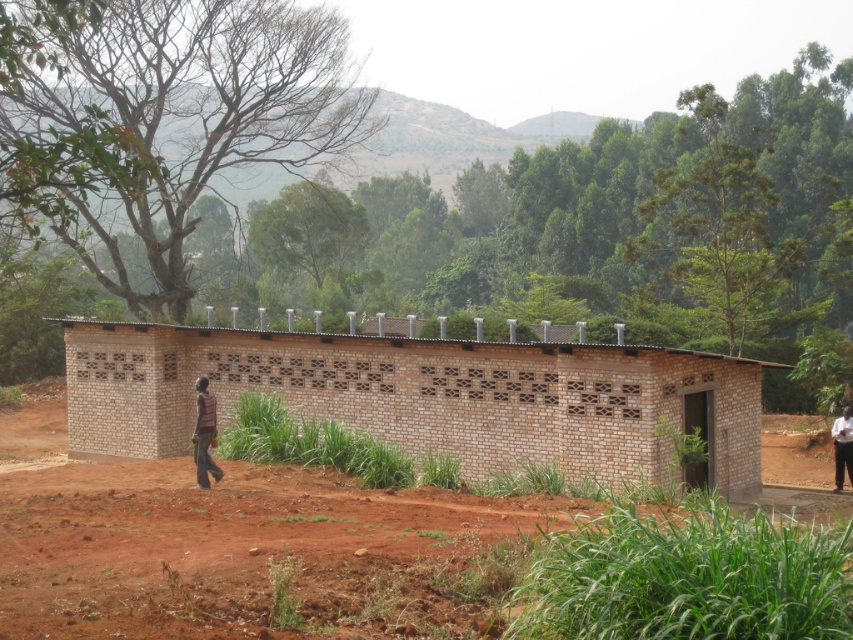
Question: Which object is farther from the camera taking this photo?

Choices:
 (A) dark brown leather jacket at lower right
 (B) striped fabric shirt at lower left

Answer: (A)

Question: Among these points, which one is farthest from the camera?

Choices:
 (A) (201, 401)
 (B) (601, 476)
 (C) (837, 426)

Answer: (C)

Question: Among these points, which one is nearest to the camera?

Choices:
 (A) (180, 371)
 (B) (490, 602)

Answer: (B)

Question: Is brown dirt field at center positioned before striped fabric shirt at lower left?

Choices:
 (A) yes
 (B) no

Answer: (A)

Question: Does brown dirt field at center have a smaller size compared to dark brown leather jacket at lower right?

Choices:
 (A) no
 (B) yes

Answer: (A)

Question: Does brown brick hut at center have a larger size compared to dark brown leather jacket at lower right?

Choices:
 (A) no
 (B) yes

Answer: (B)